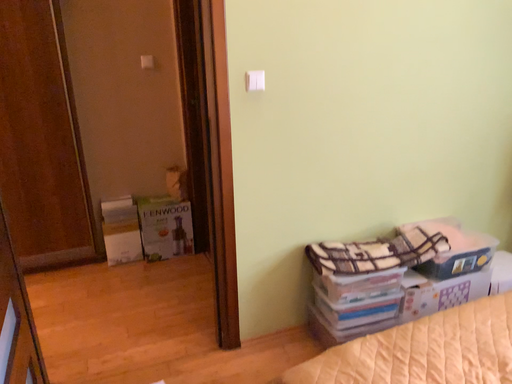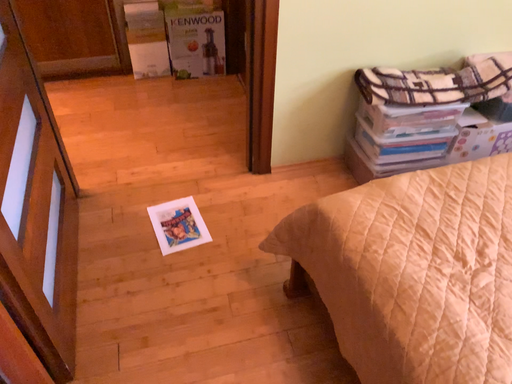
Question: How did the camera likely rotate when shooting the video?

Choices:
 (A) rotated downward
 (B) rotated upward

Answer: (A)